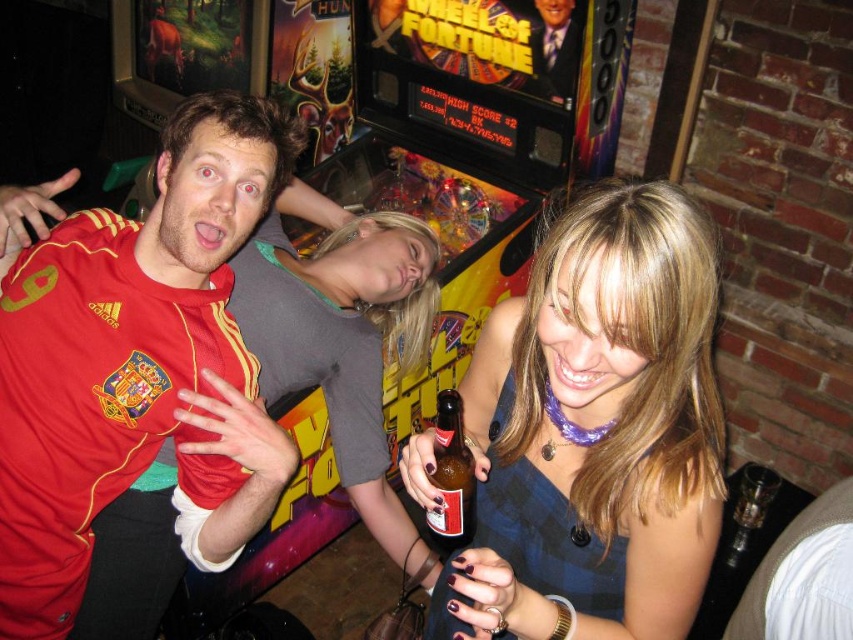
Is matte blue dress at center below brown glass bottle at center?

Correct, matte blue dress at center is located below brown glass bottle at center.

Between matte blue dress at center and brown glass bottle at center, which one appears on the left side from the viewer's perspective?

Positioned to the left is brown glass bottle at center.

Between point (672, 480) and point (453, 432), which one is positioned in front?

Point (672, 480) is in front.

I want to click on matte blue dress at center, so click(595, 432).

Is matte blue dress at center thinner than matte jersey at left?

Correct, matte blue dress at center's width is less than matte jersey at left's.

Consider the image. Who is shorter, matte blue dress at center or matte jersey at left?

Standing shorter between the two is matte blue dress at center.

Does point (643, 202) lie in front of point (65, 328)?

Yes.

I want to click on matte blue dress at center, so click(595, 432).

In the scene shown: Which is more to the right, matte jersey at left or brown glass bottle at center?

Positioned to the right is brown glass bottle at center.

Does matte jersey at left appear under brown glass bottle at center?

No, matte jersey at left is not below brown glass bottle at center.

Is point (86, 515) positioned after point (450, 481)?

That is True.

Locate an element on the screen. The height and width of the screenshot is (640, 853). matte jersey at left is located at coordinates (128, 355).